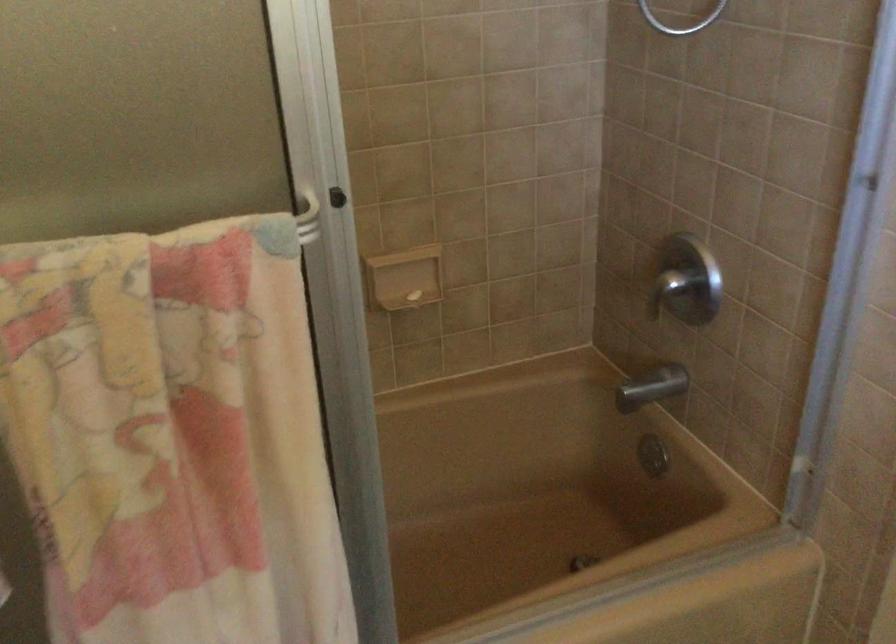
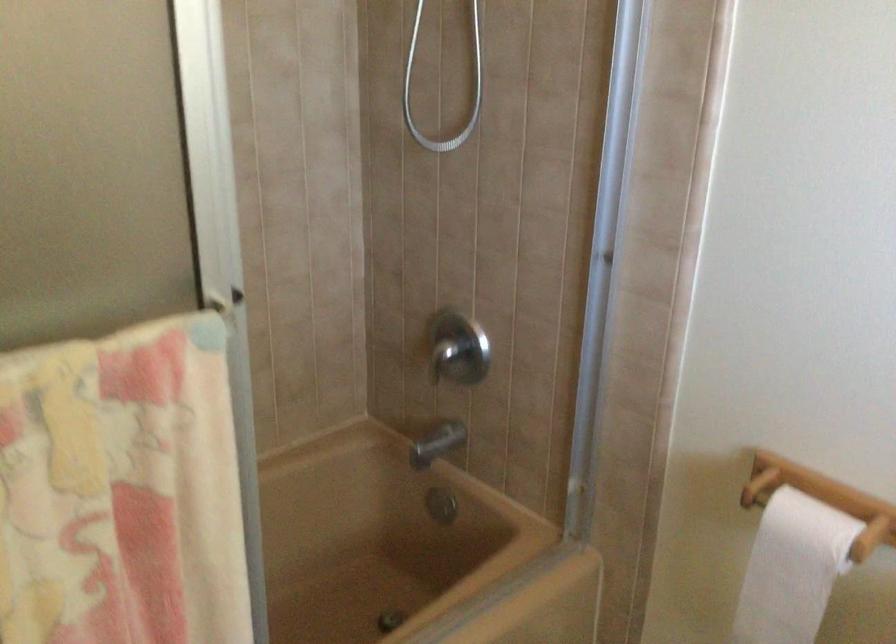
Locate, in the second image, the point that corresponds to pixel 648 384 in the first image.

(436, 444)